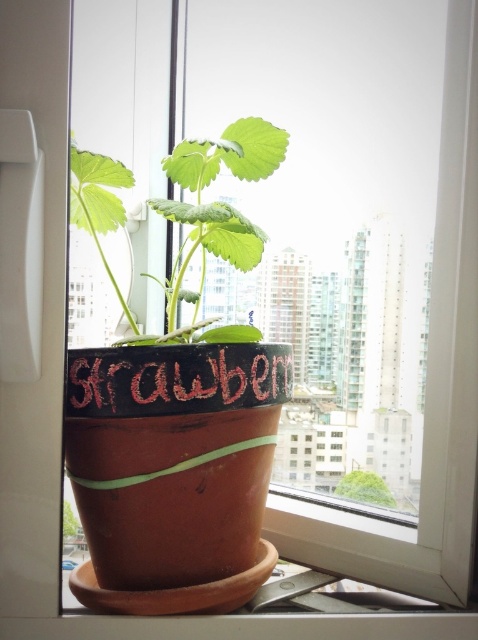
Question: Estimate the real-world distances between objects in this image. Which object is farther from the green matte leafy plant at center?

Choices:
 (A) chalky black sign at center
 (B) green matte pot at center

Answer: (B)

Question: Is green matte leafy plant at center smaller than chalky black sign at center?

Choices:
 (A) yes
 (B) no

Answer: (B)

Question: Estimate the real-world distances between objects in this image. Which object is closer to the green matte leafy plant at center?

Choices:
 (A) green matte pot at center
 (B) chalky black sign at center

Answer: (B)

Question: Considering the relative positions of green matte leafy plant at center and green matte pot at center in the image provided, where is green matte leafy plant at center located with respect to green matte pot at center?

Choices:
 (A) above
 (B) below

Answer: (A)

Question: Among these points, which one is nearest to the camera?

Choices:
 (A) (348, 477)
 (B) (176, 340)

Answer: (B)

Question: Can you confirm if green matte leafy plant at center is wider than chalky black sign at center?

Choices:
 (A) yes
 (B) no

Answer: (A)